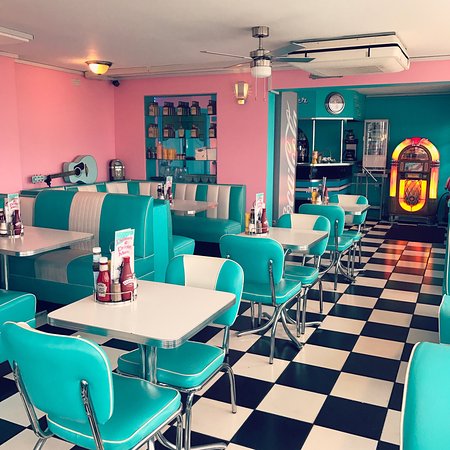
Where is `jukebox`? jukebox is located at coordinates click(x=421, y=180).